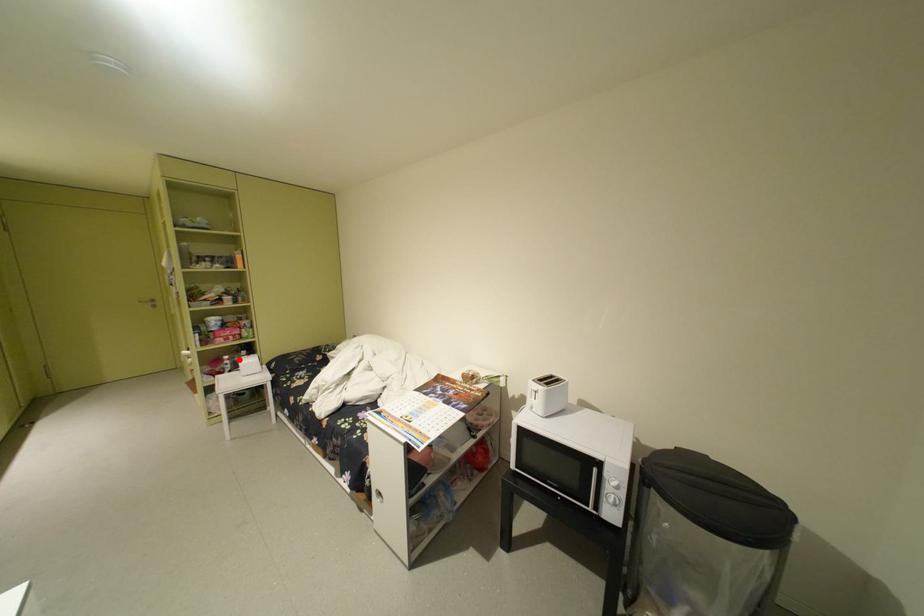
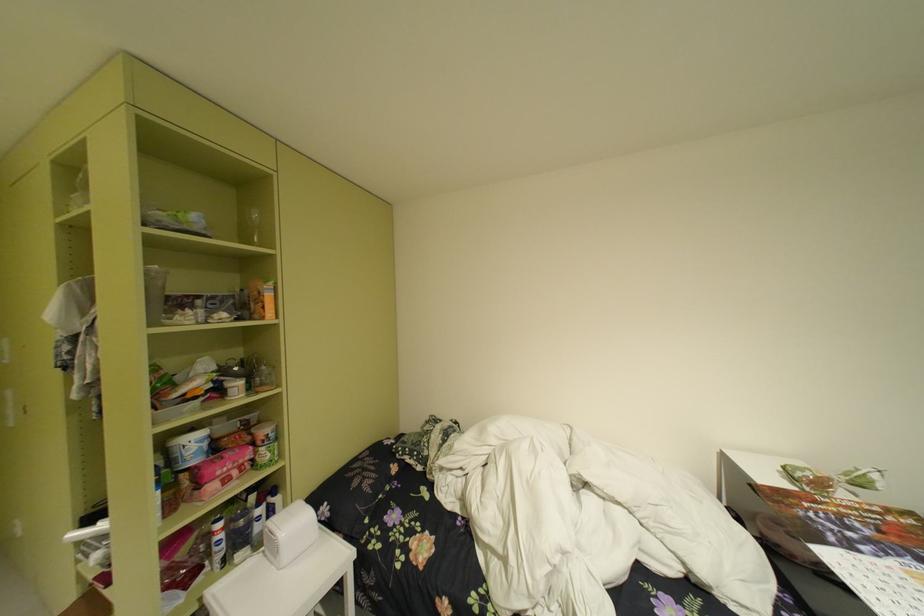
Locate, in the second image, the point that corresponds to the highlighted location in the first image.

(235, 528)